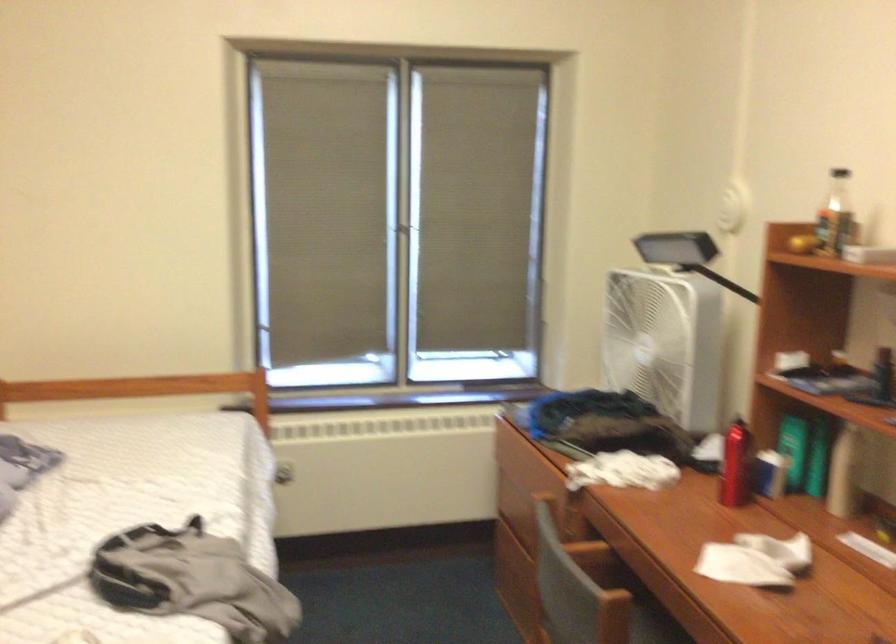
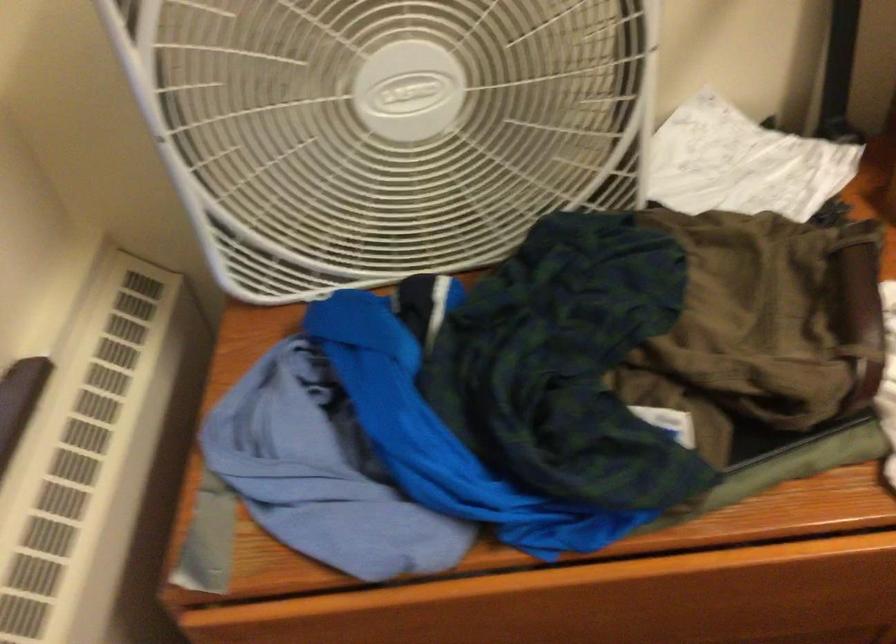
The point at [638,353] is marked in the first image. Where is the corresponding point in the second image?

(385, 127)